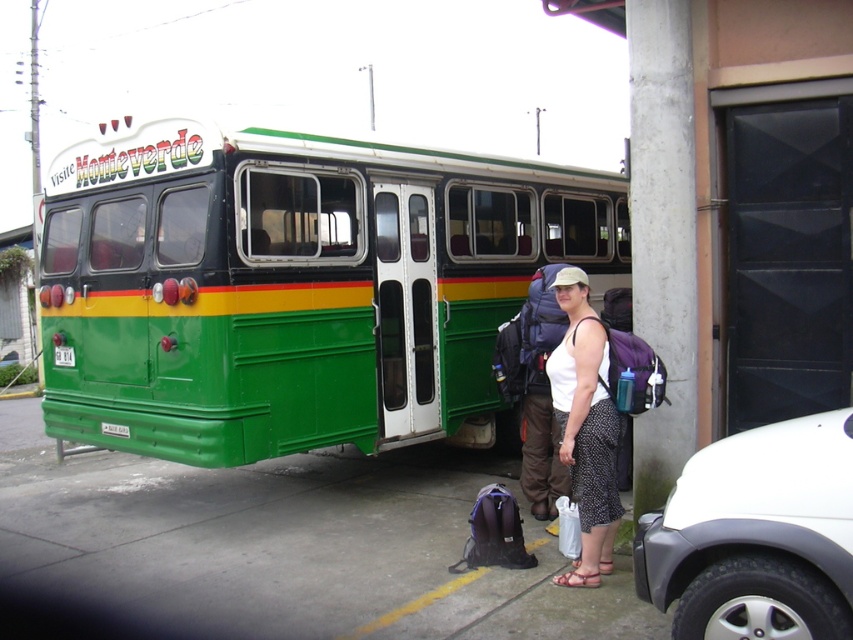
Question: Observing the image, what is the correct spatial positioning of green matte bus at center in reference to white fabric tank top at center?

Choices:
 (A) left
 (B) right

Answer: (A)

Question: Does green matte bus at center lie in front of white fabric tank top at center?

Choices:
 (A) no
 (B) yes

Answer: (A)

Question: Is green matte bus at center thinner than white fabric tank top at center?

Choices:
 (A) no
 (B) yes

Answer: (A)